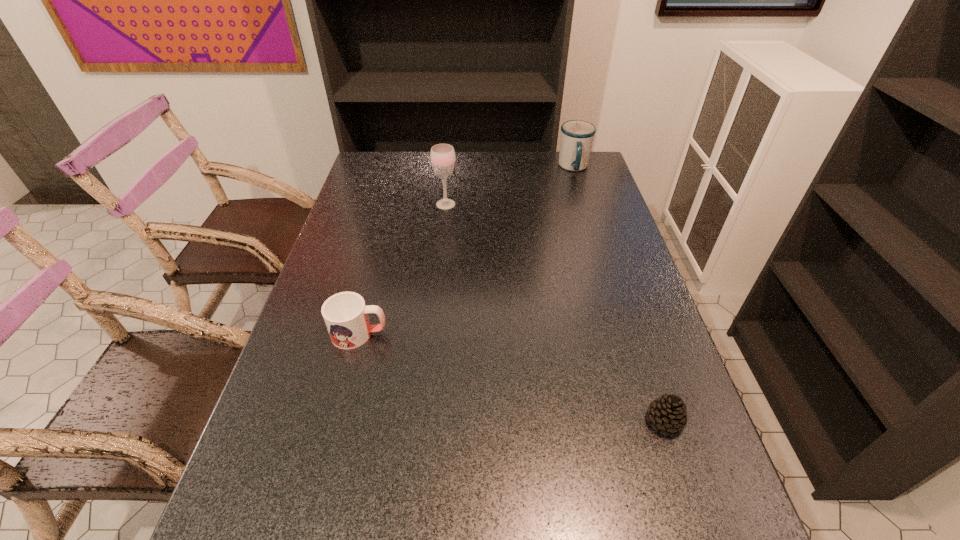
I want to click on free space at the left edge of the desktop, so click(346, 228).

At what (x,y) coordinates should I click in order to perform the action: click on free region at the right edge of the desktop. Please return your answer as a coordinate pair (x, y). Looking at the image, I should click on (602, 186).

The height and width of the screenshot is (540, 960). Identify the location of free space at the far right corner of the desktop. (592, 183).

Where is `empty space between the tallest object and the leftmost object`? empty space between the tallest object and the leftmost object is located at coordinates (402, 269).

Identify the location of free point between the third nearest object and the second nearest object. (402, 269).

Identify the location of free space between the right mug and the wineglass. This screenshot has height=540, width=960. (510, 186).

Locate an element on the screen. Image resolution: width=960 pixels, height=540 pixels. vacant space that's between the wineglass and the farthest object is located at coordinates (510, 186).

At what (x,y) coordinates should I click in order to perform the action: click on empty location between the pinecone and the farthest object. Please return your answer as a coordinate pair (x, y). Looking at the image, I should click on (619, 294).

At what (x,y) coordinates should I click in order to perform the action: click on vacant area between the left mug and the third object from right to left. Please return your answer as a coordinate pair (x, y). Looking at the image, I should click on (402, 269).

The width and height of the screenshot is (960, 540). I want to click on vacant space that is in between the pinecone and the left mug, so click(512, 377).